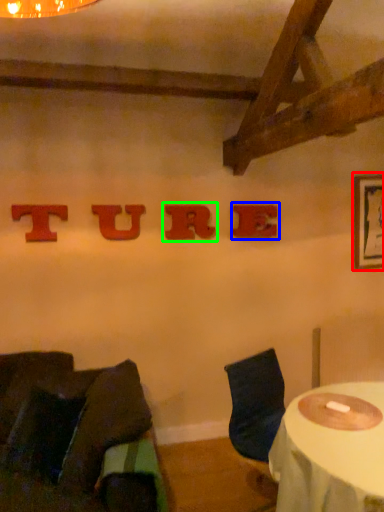
Question: Estimate the real-world distances between objects in this image. Which object is closer to picture frame (highlighted by a red box), alphabet (highlighted by a blue box) or alphabet (highlighted by a green box)?

Choices:
 (A) alphabet
 (B) alphabet

Answer: (A)